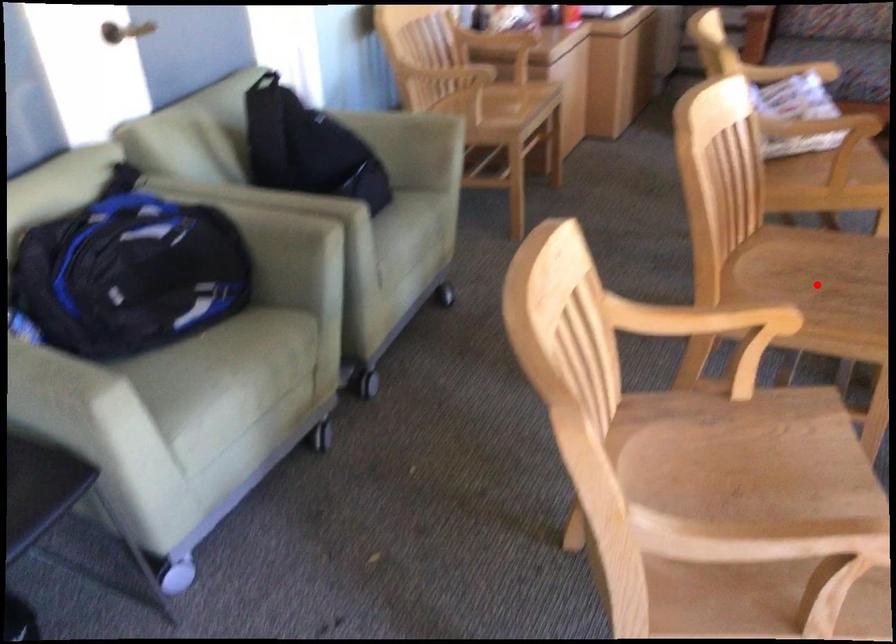
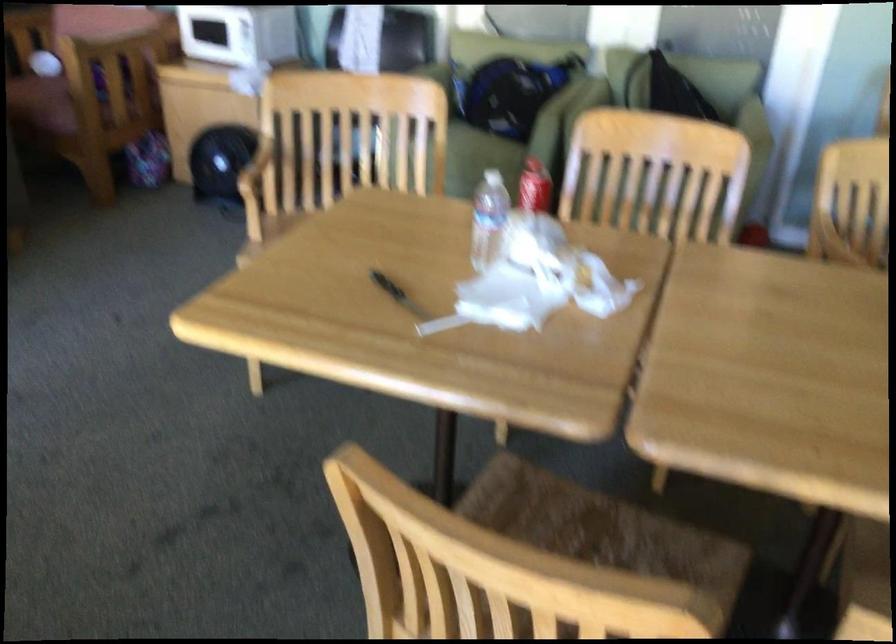
Question: I am providing you with two images of the same scene from different viewpoints. A red point is marked on the first image. Can you still see the location of the red point in image 2?

Choices:
 (A) Yes
 (B) No

Answer: (B)